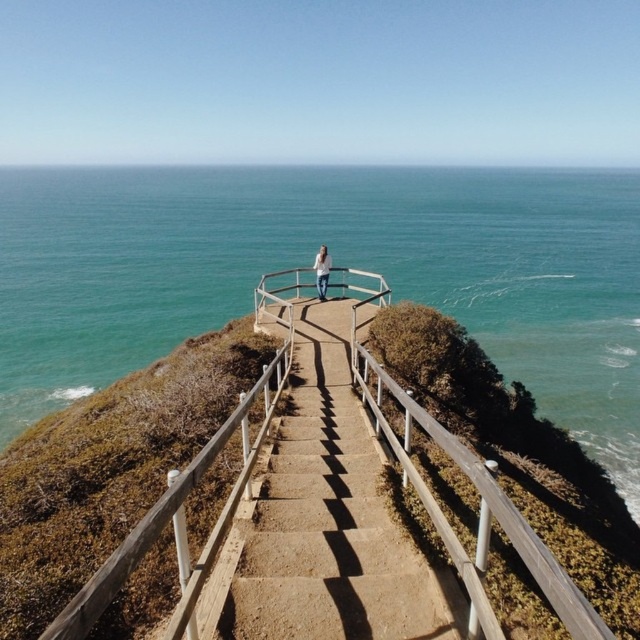
Question: Is brown concrete stairs at center above white cotton shirt at center?

Choices:
 (A) no
 (B) yes

Answer: (A)

Question: Can you confirm if brown concrete stairs at center is positioned to the right of white cotton shirt at center?

Choices:
 (A) no
 (B) yes

Answer: (B)

Question: Which of these objects is positioned closest to the white cotton shirt at center?

Choices:
 (A) blue water at upper center
 (B) brown concrete stairs at center

Answer: (B)

Question: Where is blue water at upper center located in relation to brown concrete stairs at center in the image?

Choices:
 (A) below
 (B) above

Answer: (B)

Question: Which object appears farthest from the camera in this image?

Choices:
 (A) blue water at upper center
 (B) white cotton shirt at center
 (C) brown concrete stairs at center

Answer: (A)

Question: Among these points, which one is nearest to the camera?

Choices:
 (A) (557, 385)
 (B) (320, 300)
 (C) (288, 452)

Answer: (C)